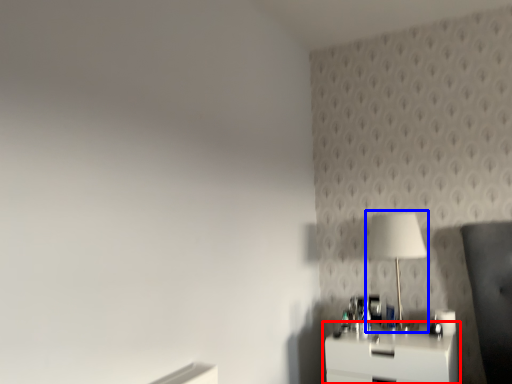
Question: Which of the following is the closest to the observer, nightstand (highlighted by a red box) or table lamp (highlighted by a blue box)?

Choices:
 (A) nightstand
 (B) table lamp

Answer: (A)